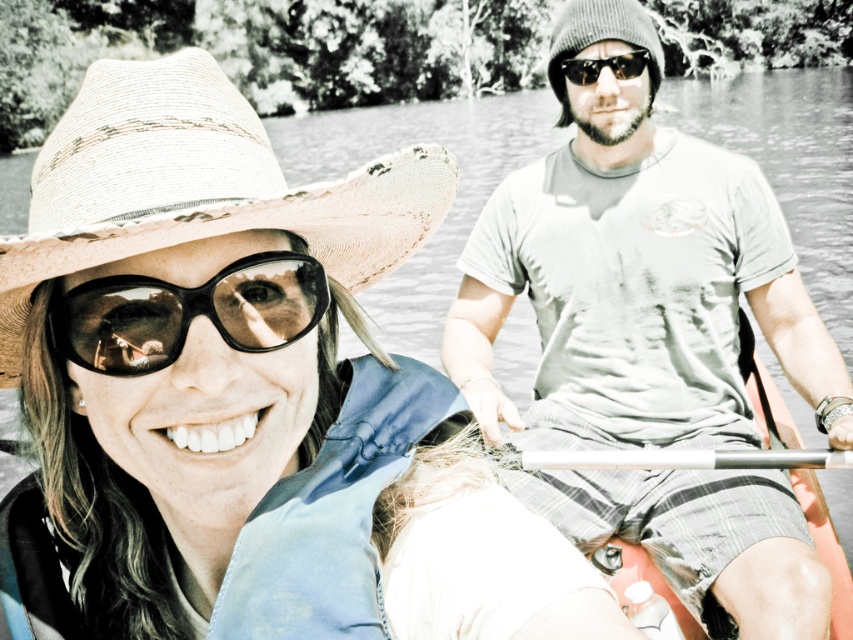
Question: Can you confirm if matte gray t-shirt at center is smaller than black matte sunglasses at center?

Choices:
 (A) no
 (B) yes

Answer: (A)

Question: Considering the real-world distances, which object is closest to the silver metallic paddle at center?

Choices:
 (A) matte gray t-shirt at center
 (B) natural straw cowboy hat at left
 (C) matte straw hat at left
 (D) black reflective sunglasses at upper center

Answer: (A)

Question: Does silver metallic paddle at center lie in front of black reflective sunglasses at upper center?

Choices:
 (A) no
 (B) yes

Answer: (B)

Question: Does black matte sunglasses at center appear over silver metallic paddle at center?

Choices:
 (A) yes
 (B) no

Answer: (A)

Question: Which object appears farthest from the camera in this image?

Choices:
 (A) black matte sunglasses at center
 (B) matte gray t-shirt at center

Answer: (B)

Question: Which object is positioned closest to the black matte sunglasses at center?

Choices:
 (A) matte gray t-shirt at center
 (B) silver metallic paddle at center
 (C) black reflective sunglasses at upper center

Answer: (B)